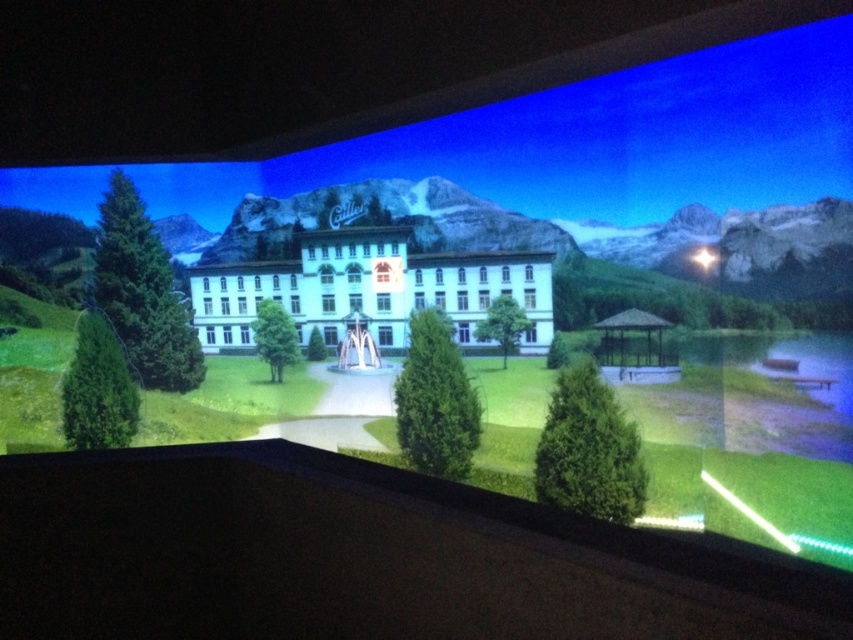
Who is positioned more to the right, white glossy mountain at center or white glossy building at center?

From the viewer's perspective, white glossy mountain at center appears more on the right side.

Can you confirm if white glossy mountain at center is wider than white glossy building at center?

Indeed, white glossy mountain at center has a greater width compared to white glossy building at center.

At what (x,y) coordinates should I click in order to perform the action: click on white glossy mountain at center. Please return your answer as a coordinate pair (x, y). Image resolution: width=853 pixels, height=640 pixels. Looking at the image, I should click on (573, 248).

The image size is (853, 640). Describe the element at coordinates (750, 442) in the screenshot. I see `green grassy golf course at center` at that location.

What do you see at coordinates (750, 442) in the screenshot? This screenshot has height=640, width=853. I see `green grassy golf course at center` at bounding box center [750, 442].

Find the location of a particular element. The width and height of the screenshot is (853, 640). green grassy golf course at center is located at coordinates (750, 442).

Does point (682, 525) come in front of point (440, 259)?

Yes, it is.

Can you confirm if green grassy golf course at center is positioned above white glossy building at center?

Incorrect, green grassy golf course at center is not positioned above white glossy building at center.

Is point (833, 452) farther from camera compared to point (393, 288)?

No, it is in front of (393, 288).

Find the location of a particular element. green grassy golf course at center is located at coordinates (750, 442).